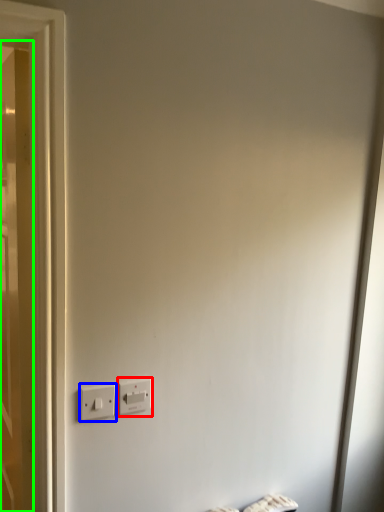
Question: Which is nearer to the power plugs and sockets (highlighted by a red box)? power plugs and sockets (highlighted by a blue box) or door (highlighted by a green box).

Choices:
 (A) power plugs and sockets
 (B) door

Answer: (A)